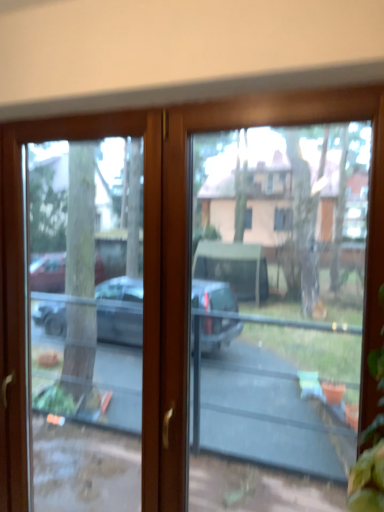
Question: Are transparent glass door at center and transparent glass screen door at left beside each other?

Choices:
 (A) yes
 (B) no

Answer: (B)

Question: Is transparent glass door at center shorter than transparent glass screen door at left?

Choices:
 (A) no
 (B) yes

Answer: (B)

Question: Is the depth of transparent glass door at center greater than that of transparent glass screen door at left?

Choices:
 (A) no
 (B) yes

Answer: (A)

Question: Does transparent glass door at center have a larger size compared to transparent glass screen door at left?

Choices:
 (A) no
 (B) yes

Answer: (A)

Question: Considering the relative sizes of transparent glass door at center and transparent glass screen door at left in the image provided, is transparent glass door at center wider than transparent glass screen door at left?

Choices:
 (A) no
 (B) yes

Answer: (B)

Question: Does transparent glass door at center have a smaller size compared to transparent glass screen door at left?

Choices:
 (A) yes
 (B) no

Answer: (A)

Question: Can you confirm if transparent glass screen door at left is smaller than transparent glass door at center?

Choices:
 (A) no
 (B) yes

Answer: (A)

Question: Is transparent glass screen door at left taller than transparent glass door at center?

Choices:
 (A) yes
 (B) no

Answer: (A)

Question: Is transparent glass screen door at left not inside transparent glass door at center?

Choices:
 (A) no
 (B) yes

Answer: (B)

Question: From the image's perspective, would you say transparent glass screen door at left is positioned over transparent glass door at center?

Choices:
 (A) no
 (B) yes

Answer: (A)

Question: Is transparent glass screen door at left closer to the viewer compared to transparent glass door at center?

Choices:
 (A) no
 (B) yes

Answer: (A)

Question: From the image's perspective, would you say transparent glass screen door at left is shown under transparent glass door at center?

Choices:
 (A) no
 (B) yes

Answer: (B)

Question: Considering their positions, is transparent glass screen door at left located in front of or behind transparent glass door at center?

Choices:
 (A) front
 (B) behind

Answer: (B)